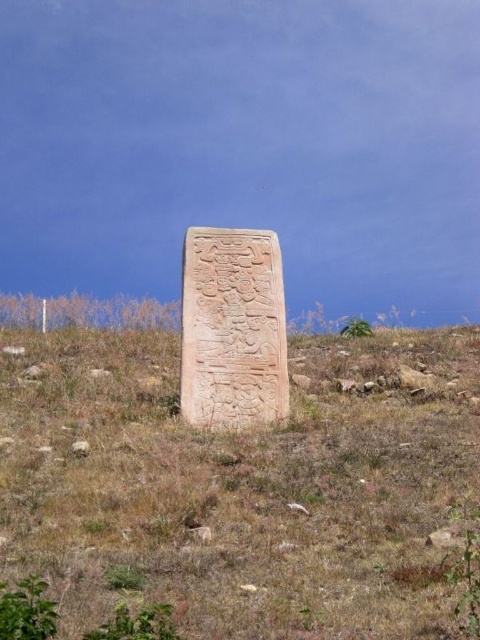
Question: Which object is farther from the camera taking this photo?

Choices:
 (A) carved stone monument at center
 (B) brown grassy at center

Answer: (A)

Question: Does brown grassy at center come in front of carved stone monument at center?

Choices:
 (A) yes
 (B) no

Answer: (A)

Question: Does brown grassy at center come behind carved stone monument at center?

Choices:
 (A) no
 (B) yes

Answer: (A)

Question: Which point is closer to the camera?

Choices:
 (A) brown grassy at center
 (B) carved stone monument at center

Answer: (A)

Question: Which of the following is the closest to the observer?

Choices:
 (A) brown grassy at center
 (B) carved stone monument at center

Answer: (A)

Question: Does brown grassy at center appear over carved stone monument at center?

Choices:
 (A) yes
 (B) no

Answer: (B)